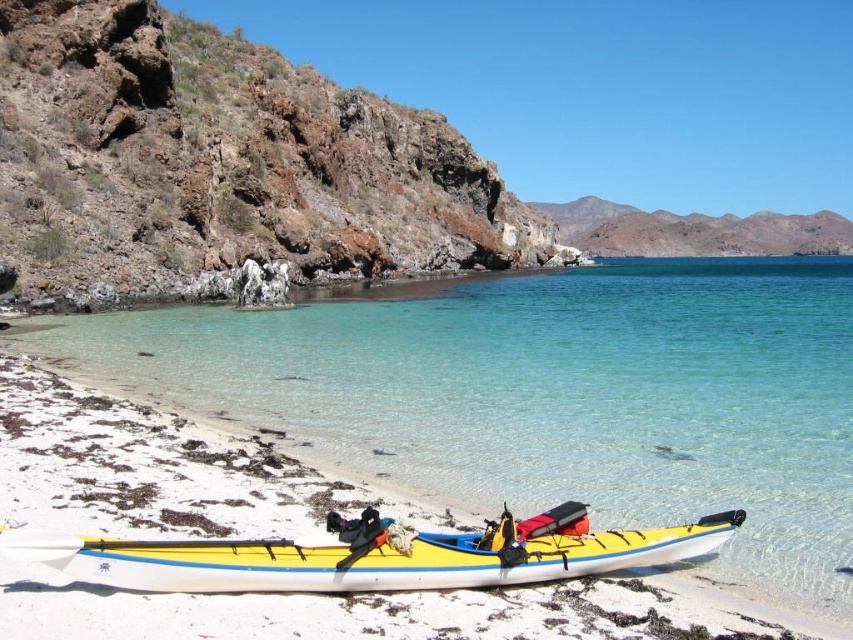
Is clear water at lower center to the right of rusty rock at upper left from the viewer's perspective?

Indeed, clear water at lower center is positioned on the right side of rusty rock at upper left.

Image resolution: width=853 pixels, height=640 pixels. What do you see at coordinates (554, 396) in the screenshot?
I see `clear water at lower center` at bounding box center [554, 396].

The image size is (853, 640). What do you see at coordinates (554, 396) in the screenshot? I see `clear water at lower center` at bounding box center [554, 396].

Find the location of `clear water at lower center`. clear water at lower center is located at coordinates (554, 396).

Does rusty rock at upper left have a greater width compared to yellow matte kayak at lower center?

Yes, rusty rock at upper left is wider than yellow matte kayak at lower center.

Is rusty rock at upper left positioned at the back of yellow matte kayak at lower center?

Yes, it is behind yellow matte kayak at lower center.

Locate an element on the screen. The image size is (853, 640). rusty rock at upper left is located at coordinates (221, 164).

Is point (677, 492) farther from camera compared to point (569, 522)?

Yes, point (677, 492) is behind point (569, 522).

Does clear water at lower center have a greater height compared to yellow matte kayak at lower center?

Indeed, clear water at lower center has a greater height compared to yellow matte kayak at lower center.

Is point (378, 300) more distant than point (138, 566)?

Yes, it is.

In order to click on clear water at lower center in this screenshot , I will do `click(554, 396)`.